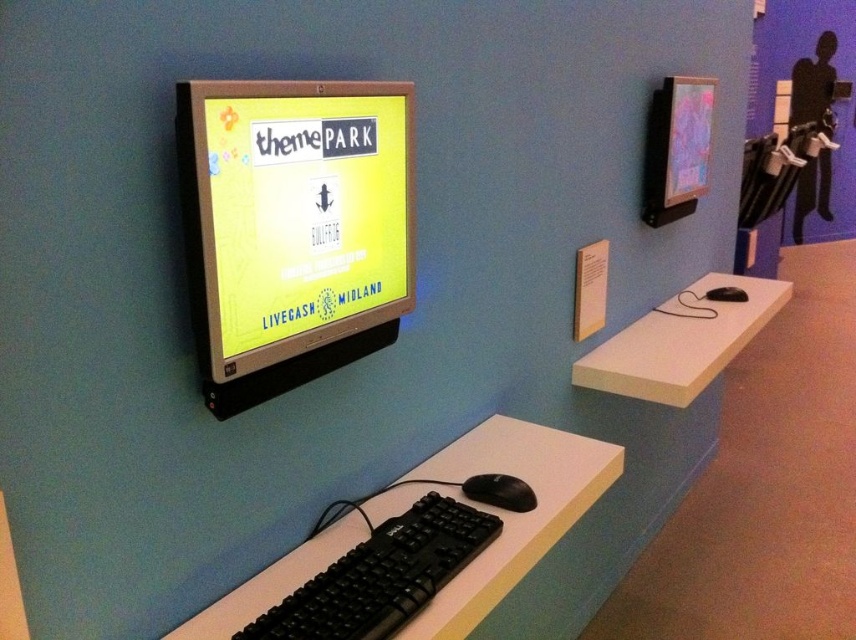
Question: Observing the image, what is the correct spatial positioning of white matte table at center in reference to black matte mouse at lower center?

Choices:
 (A) right
 (B) left

Answer: (A)

Question: Among these points, which one is farthest from the camera?

Choices:
 (A) (485, 596)
 (B) (516, 477)
 (C) (675, 364)
 (D) (354, 573)

Answer: (C)

Question: Among these objects, which one is farthest from the camera?

Choices:
 (A) black plastic keyboard and mouse at lower center
 (B) white matte table at center
 (C) matte black monitor at center

Answer: (B)

Question: Can you confirm if black plastic keyboard and mouse at lower center is wider than black matte mouse at lower center?

Choices:
 (A) no
 (B) yes

Answer: (B)

Question: Is matte black monitor at center positioned before black plastic keyboard at lower center?

Choices:
 (A) yes
 (B) no

Answer: (A)

Question: Which of the following is the closest to the observer?

Choices:
 (A) (738, 337)
 (B) (452, 550)
 (C) (502, 577)
 (D) (498, 480)

Answer: (B)